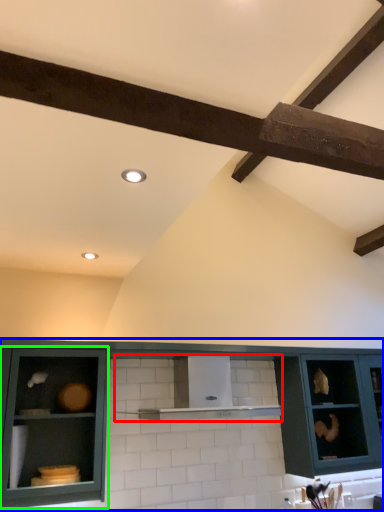
Question: Which object is positioned farthest from shelf (highlighted by a red box)? Select from cabinetry (highlighted by a blue box) and cabinetry (highlighted by a green box).

Choices:
 (A) cabinetry
 (B) cabinetry

Answer: (B)